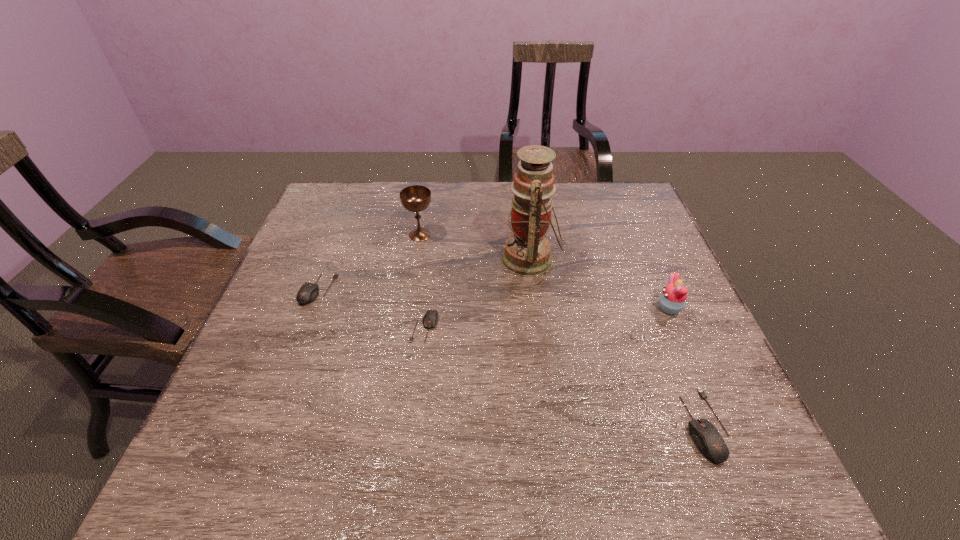
Locate an element on the screen. The width and height of the screenshot is (960, 540). free space that is in between the fourth shortest object and the rightmost mouse is located at coordinates (686, 367).

Identify the location of vacant space that is in between the rightmost mouse and the oil lamp. (617, 342).

The width and height of the screenshot is (960, 540). What are the coordinates of `free space that is in between the tallest object and the nearest object` in the screenshot? It's located at (617, 342).

Locate an element on the screen. The width and height of the screenshot is (960, 540). vacant point located between the fourth object from left to right and the chalice is located at coordinates (475, 247).

Identify the location of free space between the cupcake and the oil lamp. (599, 284).

Identify the location of free space between the third tallest object and the shortest object. This screenshot has height=540, width=960. (546, 318).

In order to click on empty space between the second shortest mouse and the cupcake in this screenshot , I will do `click(493, 299)`.

Image resolution: width=960 pixels, height=540 pixels. Find the location of `free point between the nearest mouse and the second nearest mouse`. free point between the nearest mouse and the second nearest mouse is located at coordinates (564, 376).

Locate an element on the screen. The height and width of the screenshot is (540, 960). vacant area that lies between the chalice and the leftmost object is located at coordinates (369, 262).

Find the location of a particular element. object that is the second closest to the fourth shortest object is located at coordinates (527, 252).